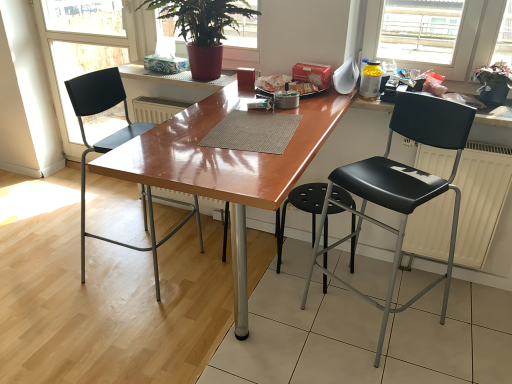
You are a GUI agent. You are given a task and a screenshot of the screen. Output one action in this format:
    pyautogui.click(x=<x>, y=<y>)
    Task: Click on the vacant space underneath black leather chair at right, the second chair from the left (from a real-world perspective)
    
    Given the screenshot: What is the action you would take?
    pyautogui.click(x=391, y=324)